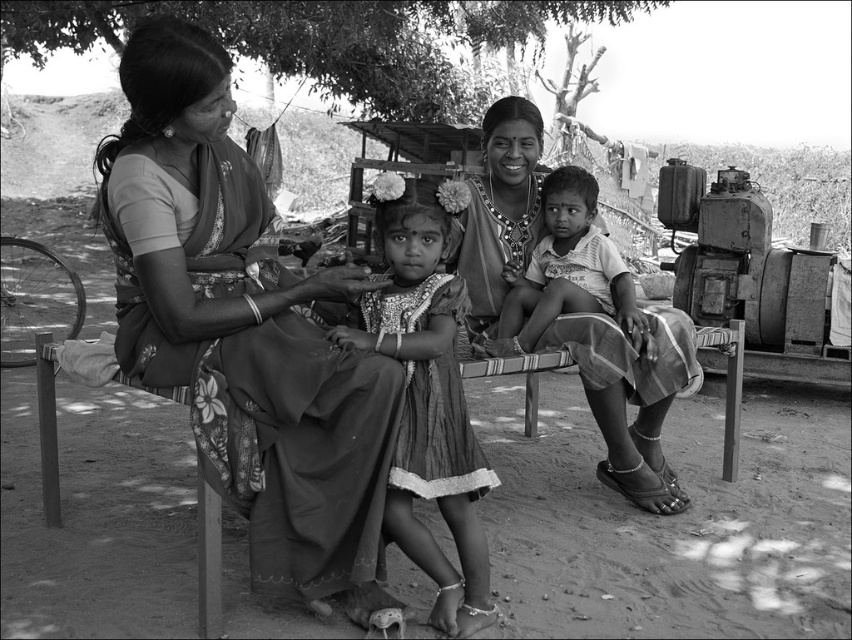
Question: Can you confirm if floral-patterned fabric at left is thinner than smooth fabric child at center?

Choices:
 (A) no
 (B) yes

Answer: (A)

Question: Which point appears closest to the camera in this image?

Choices:
 (A) (540, 282)
 (B) (403, 195)

Answer: (B)

Question: Among these objects, which one is farthest from the camera?

Choices:
 (A) textured fabric dress at center
 (B) floral-patterned fabric at left
 (C) smooth fabric child at center

Answer: (C)

Question: Is floral-patterned fabric at left positioned before smooth fabric child at center?

Choices:
 (A) yes
 (B) no

Answer: (A)

Question: Does floral-patterned fabric at left appear on the left side of smooth fabric child at center?

Choices:
 (A) yes
 (B) no

Answer: (A)

Question: Which is farther from the floral-patterned fabric at left?

Choices:
 (A) textured fabric dress at center
 (B) smooth fabric child at center

Answer: (B)